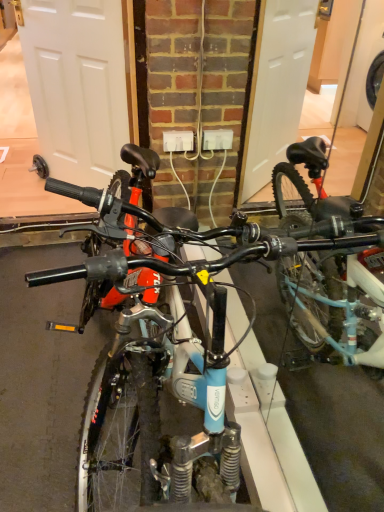
Measure the distance between point (58, 172) and camera.

The distance of point (58, 172) from camera is 8.96 feet.

What do you see at coordinates (205, 324) in the screenshot?
I see `blue matte bicycle at center` at bounding box center [205, 324].

Locate an element on the screen. white matte door at left is located at coordinates (77, 85).

Is white plastic power outlet at center at the left side of white matte door at left?

No, white plastic power outlet at center is not to the left of white matte door at left.

In the image, there is a white matte door at left. At what (x,y) coordinates should I click in order to perform the action: click on power outlet below it (from the image's perspective). Please return your answer as a coordinate pair (x, y). The height and width of the screenshot is (512, 384). Looking at the image, I should click on (178, 141).

Can you see white plastic power outlet at center touching white matte door at left?

No, white plastic power outlet at center is not beside white matte door at left.

From the image's perspective, is white plastic power outlet at center over white matte door at left?

No.

Between point (99, 10) and point (233, 454), which one is positioned in front?

Positioned in front is point (233, 454).

Which object is closer to the camera, white matte door at left or blue matte bicycle at center?

Positioned in front is blue matte bicycle at center.

Which of these two, white matte door at left or blue matte bicycle at center, is thinner?

white matte door at left.

Would you say white matte door at left is to the left or to the right of blue matte bicycle at center in the picture?

In the image, white matte door at left appears on the left side of blue matte bicycle at center.

Between point (176, 147) and point (101, 412), which one is positioned behind?

The point (176, 147) is farther.

Who is smaller, white plastic power outlet at center or blue matte bicycle at center?

white plastic power outlet at center is smaller.

Considering the relative positions of white plastic power outlet at center and blue matte bicycle at center in the image provided, is white plastic power outlet at center to the left or to the right of blue matte bicycle at center?

In the image, white plastic power outlet at center appears on the left side of blue matte bicycle at center.

In the image, is white plastic power outlet at center positioned in front of or behind blue matte bicycle at center?

white plastic power outlet at center is positioned farther from the viewer than blue matte bicycle at center.

Where is `bicycle in front of the white plastic power outlet at center`? This screenshot has width=384, height=512. bicycle in front of the white plastic power outlet at center is located at coordinates (205, 324).

From the image's perspective, which one is positioned higher, blue matte bicycle at center or white plastic power outlet at center?

From the image's view, white plastic power outlet at center is above.

In the scene shown: Is blue matte bicycle at center directly adjacent to white plastic power outlet at center?

No, blue matte bicycle at center is not with white plastic power outlet at center.

Would you say blue matte bicycle at center is inside or outside white matte door at left?

blue matte bicycle at center is not enclosed by white matte door at left.

Which is closer, (381, 231) or (88, 9)?

Clearly, point (381, 231) is closer to the camera than point (88, 9).

From the image's perspective, would you say blue matte bicycle at center is positioned over white matte door at left?

Incorrect, from the image's perspective, blue matte bicycle at center is lower than white matte door at left.

Which object is more forward, blue matte bicycle at center or white matte door at left?

blue matte bicycle at center is closer to the camera.

Where is `power outlet on the right of white matte door at left`? power outlet on the right of white matte door at left is located at coordinates (178, 141).

From a real-world perspective, is white matte door at left located higher than white plastic power outlet at center?

Correct, in the physical world, white matte door at left is higher than white plastic power outlet at center.

From the image's perspective, is white matte door at left located above white plastic power outlet at center?

Correct, white matte door at left appears higher than white plastic power outlet at center in the image.

You are a GUI agent. You are given a task and a screenshot of the screen. Output one action in this format:
    pyautogui.click(x=<x>, y=<y>)
    Task: Click on the garage door that appears on the left of white plastic power outlet at center
    
    Given the screenshot: What is the action you would take?
    [77, 85]

This screenshot has height=512, width=384. What are the coordinates of `bicycle in front of the white matte door at left` in the screenshot? It's located at (205, 324).

Based on their spatial positions, is white matte door at left or blue matte bicycle at center further from white plastic power outlet at center?

Based on the image, blue matte bicycle at center appears to be further to white plastic power outlet at center.

Considering their positions, is blue matte bicycle at center positioned closer to white matte door at left than white plastic power outlet at center?

Based on the image, white plastic power outlet at center appears to be nearer to white matte door at left.

Looking at the image, which one is located closer to white matte door at left, white plastic power outlet at center or blue matte bicycle at center?

The object closer to white matte door at left is white plastic power outlet at center.

Based on their spatial positions, is white plastic power outlet at center or white matte door at left further from blue matte bicycle at center?

white matte door at left is positioned further to the anchor blue matte bicycle at center.

Estimate the real-world distances between objects in this image. Which object is closer to blue matte bicycle at center, white matte door at left or white plastic power outlet at center?

white plastic power outlet at center.

Based on their spatial positions, is blue matte bicycle at center or white matte door at left closer to white plastic power outlet at center?

white matte door at left is closer to white plastic power outlet at center.

This screenshot has height=512, width=384. In order to click on garage door between blue matte bicycle at center and white plastic power outlet at center along the z-axis in this screenshot , I will do `click(77, 85)`.